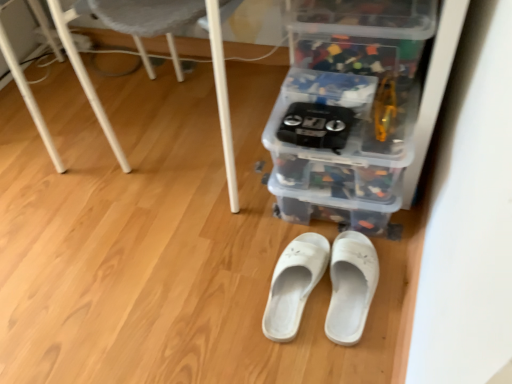
At what (x,y) coordinates should I click in order to perform the action: click on white fabric slippers at center, the 1th footwear from the left. Please return your answer as a coordinate pair (x, y). The height and width of the screenshot is (384, 512). Looking at the image, I should click on (351, 286).

What is the approximate height of white fabric slipper at center, the 2th footwear positioned from the left?

7.73 centimeters.

What do you see at coordinates (177, 55) in the screenshot? This screenshot has height=384, width=512. I see `white plastic chair at lower center` at bounding box center [177, 55].

The height and width of the screenshot is (384, 512). Find the location of `clear plastic storage box at center, which ranks as the third storage box in top-to-bottom order`. clear plastic storage box at center, which ranks as the third storage box in top-to-bottom order is located at coordinates (342, 196).

Does white fabric slippers at center, the 1th footwear from the left, have a smaller size compared to transparent plastic storage box at center, the 2th storage box positioned from the bottom?

Yes.

Between point (309, 237) and point (436, 1), which one is positioned behind?

Positioned behind is point (309, 237).

Considering the sizes of objects white fabric slippers at center, placed as the second footwear when sorted from right to left, and transparent plastic storage box at center, which is the second storage box in top-to-bottom order, in the image provided, who is taller, white fabric slippers at center, placed as the second footwear when sorted from right to left, or transparent plastic storage box at center, which is the second storage box in top-to-bottom order,?

With more height is transparent plastic storage box at center, which is the second storage box in top-to-bottom order.

Looking at their sizes, would you say white fabric slippers at center, placed as the second footwear when sorted from right to left, is wider or thinner than transparent plastic storage box at center, the 2th storage box positioned from the bottom?

Clearly, white fabric slippers at center, placed as the second footwear when sorted from right to left, has less width compared to transparent plastic storage box at center, the 2th storage box positioned from the bottom.

You are a GUI agent. You are given a task and a screenshot of the screen. Output one action in this format:
    pyautogui.click(x=<x>, y=<y>)
    Task: Click on the storage box located on the right of transparent plastic storage box at center, which is the second storage box in top-to-bottom order
    This screenshot has width=512, height=384.
    Given the screenshot: What is the action you would take?
    pyautogui.click(x=356, y=55)

Which of these two, transparent plastic storage box at center, the 2th storage box positioned from the bottom, or translucent plastic storage box at center, the 1th storage box in the top-to-bottom sequence, stands shorter?

With less height is translucent plastic storage box at center, the 1th storage box in the top-to-bottom sequence.

Is transparent plastic storage box at center, the 2th storage box positioned from the bottom, next to translucent plastic storage box at center, the 3th storage box in the bottom-to-top sequence?

No, transparent plastic storage box at center, the 2th storage box positioned from the bottom, is not with translucent plastic storage box at center, the 3th storage box in the bottom-to-top sequence.

Locate an element on the screen. furniture on the left of the translucent plastic storage box at center, the 3th storage box in the bottom-to-top sequence is located at coordinates 177,55.

How distant is translucent plastic storage box at center, the 3th storage box in the bottom-to-top sequence, from white plastic chair at lower center?

translucent plastic storage box at center, the 3th storage box in the bottom-to-top sequence, and white plastic chair at lower center are 14.52 inches apart from each other.

Which is in front, point (342, 37) or point (140, 3)?

The point (342, 37) is more forward.

Can you confirm if translucent plastic storage box at center, the 1th storage box in the top-to-bottom sequence, is shorter than white plastic chair at lower center?

Correct, translucent plastic storage box at center, the 1th storage box in the top-to-bottom sequence, is not as tall as white plastic chair at lower center.

Considering the sizes of objects white fabric slipper at center, the 2th footwear positioned from the left, and transparent plastic storage box at center, which is the second storage box in top-to-bottom order, in the image provided, who is thinner, white fabric slipper at center, the 2th footwear positioned from the left, or transparent plastic storage box at center, which is the second storage box in top-to-bottom order,?

white fabric slipper at center, the 2th footwear positioned from the left, is thinner.

Is white fabric slipper at center, the 2th footwear positioned from the left, not within transparent plastic storage box at center, the 2th storage box positioned from the bottom?

Indeed, white fabric slipper at center, the 2th footwear positioned from the left, is completely outside transparent plastic storage box at center, the 2th storage box positioned from the bottom.

Consider the image. Could you tell me if white fabric slipper at center, which is the first footwear from right to left, is turned towards transparent plastic storage box at center, which is the second storage box in top-to-bottom order?

No.

Between white fabric slipper at center, the 2th footwear positioned from the left, and transparent plastic storage box at center, which is the second storage box in top-to-bottom order, which one is positioned in front?

transparent plastic storage box at center, which is the second storage box in top-to-bottom order, is closer to the camera.

From a real-world perspective, which object rests below the other?

From a 3D spatial view, white fabric slippers at center, placed as the second footwear when sorted from right to left, is below.

Is white fabric slipper at center, the 2th footwear positioned from the left, taller or shorter than white fabric slippers at center, the 1th footwear from the left?

Clearly, white fabric slipper at center, the 2th footwear positioned from the left, is shorter compared to white fabric slippers at center, the 1th footwear from the left.

Is white fabric slippers at center, placed as the second footwear when sorted from right to left, surrounded by white fabric slipper at center, the 2th footwear positioned from the left?

No.

Considering the sizes of objects white fabric slipper at center, which is the first footwear from right to left, and white fabric slippers at center, placed as the second footwear when sorted from right to left, in the image provided, who is thinner, white fabric slipper at center, which is the first footwear from right to left, or white fabric slippers at center, placed as the second footwear when sorted from right to left,?

white fabric slippers at center, placed as the second footwear when sorted from right to left, is thinner.

Considering the sizes of objects white plastic chair at lower center and transparent plastic storage box at center, the 2th storage box positioned from the bottom, in the image provided, who is smaller, white plastic chair at lower center or transparent plastic storage box at center, the 2th storage box positioned from the bottom,?

transparent plastic storage box at center, the 2th storage box positioned from the bottom.

Considering the positions of point (236, 185) and point (302, 133), is point (236, 185) closer or farther from the camera than point (302, 133)?

Point (236, 185).

From the image's perspective, is white plastic chair at lower center located above or below transparent plastic storage box at center, the 2th storage box positioned from the bottom?

Clearly, from the image's perspective, white plastic chair at lower center is above transparent plastic storage box at center, the 2th storage box positioned from the bottom.

From a real-world perspective, who is located higher, white plastic chair at lower center or transparent plastic storage box at center, which is the second storage box in top-to-bottom order?

white plastic chair at lower center.

How many degrees apart are the facing directions of white fabric slippers at center, placed as the second footwear when sorted from right to left, and white fabric slipper at center, the 2th footwear positioned from the left?

The angular difference between white fabric slippers at center, placed as the second footwear when sorted from right to left, and white fabric slipper at center, the 2th footwear positioned from the left, is 0 degrees.

Considering the positions of objects white fabric slippers at center, the 1th footwear from the left, and white fabric slipper at center, which is the first footwear from right to left, in the image provided, who is in front, white fabric slippers at center, the 1th footwear from the left, or white fabric slipper at center, which is the first footwear from right to left,?

A: white fabric slipper at center, which is the first footwear from right to left, is closer to the camera.

Is white fabric slippers at center, placed as the second footwear when sorted from right to left, spatially inside white fabric slipper at center, the 2th footwear positioned from the left, or outside of it?

white fabric slippers at center, placed as the second footwear when sorted from right to left, is spatially situated outside white fabric slipper at center, the 2th footwear positioned from the left.

From the transparent plastic storage box at center, the 2th storage box positioned from the bottom, count 2nd footwears backward and point to it. Please provide its 2D coordinates.

[(351, 286)]

At what (x,y) coordinates should I click in order to perform the action: click on storage box on the right of transparent plastic storage box at center, the 2th storage box positioned from the bottom. Please return your answer as a coordinate pair (x, y). This screenshot has height=384, width=512. Looking at the image, I should click on (356, 55).

When comparing their distances from white fabric slippers at center, placed as the second footwear when sorted from right to left, does translucent plastic storage box at center, the 1th storage box in the top-to-bottom sequence, or clear plastic storage box at center, which ranks as the third storage box in top-to-bottom order, seem closer?

The object closer to white fabric slippers at center, placed as the second footwear when sorted from right to left, is clear plastic storage box at center, which ranks as the third storage box in top-to-bottom order.

In the scene shown: Estimate the real-world distances between objects in this image. Which object is closer to white fabric slipper at center, which is the first footwear from right to left, translucent plastic storage box at center, the 3th storage box in the bottom-to-top sequence, or white plastic chair at lower center?

The object closer to white fabric slipper at center, which is the first footwear from right to left, is translucent plastic storage box at center, the 3th storage box in the bottom-to-top sequence.

Which object lies further to the anchor point white plastic chair at lower center, clear plastic storage box at center, which is the first storage box in bottom-to-top order, or transparent plastic storage box at center, the 2th storage box positioned from the bottom?

clear plastic storage box at center, which is the first storage box in bottom-to-top order.

Estimate the real-world distances between objects in this image. Which object is closer to white fabric slippers at center, placed as the second footwear when sorted from right to left, clear plastic storage box at center, which ranks as the third storage box in top-to-bottom order, or white plastic chair at lower center?

clear plastic storage box at center, which ranks as the third storage box in top-to-bottom order.

Estimate the real-world distances between objects in this image. Which object is further from transparent plastic storage box at center, the 2th storage box positioned from the bottom, white plastic chair at lower center or translucent plastic storage box at center, the 3th storage box in the bottom-to-top sequence?

Among the two, white plastic chair at lower center is located further to transparent plastic storage box at center, the 2th storage box positioned from the bottom.

When comparing their distances from clear plastic storage box at center, which ranks as the third storage box in top-to-bottom order, does white fabric slippers at center, the 1th footwear from the left, or white fabric slipper at center, which is the first footwear from right to left, seem further?

white fabric slippers at center, the 1th footwear from the left, lies further to clear plastic storage box at center, which ranks as the third storage box in top-to-bottom order, than the other object.

Looking at the image, which one is located further to translucent plastic storage box at center, the 3th storage box in the bottom-to-top sequence, white plastic chair at lower center or white fabric slippers at center, placed as the second footwear when sorted from right to left?

white fabric slippers at center, placed as the second footwear when sorted from right to left.

Considering their positions, is white plastic chair at lower center positioned further to clear plastic storage box at center, which is the first storage box in bottom-to-top order, than white fabric slipper at center, which is the first footwear from right to left?

white plastic chair at lower center lies further to clear plastic storage box at center, which is the first storage box in bottom-to-top order, than the other object.

The image size is (512, 384). Identify the location of storage box between white plastic chair at lower center and transparent plastic storage box at center, the 2th storage box positioned from the bottom, from left to right. (342, 196).

This screenshot has height=384, width=512. Identify the location of footwear between white plastic chair at lower center and white fabric slipper at center, which is the first footwear from right to left, in the up-down direction. (351, 286).

Where is `furniture between translucent plastic storage box at center, the 3th storage box in the bottom-to-top sequence, and white fabric slippers at center, the 1th footwear from the left, in the up-down direction`? The height and width of the screenshot is (384, 512). furniture between translucent plastic storage box at center, the 3th storage box in the bottom-to-top sequence, and white fabric slippers at center, the 1th footwear from the left, in the up-down direction is located at coordinates (177, 55).

Locate an element on the screen. footwear between clear plastic storage box at center, which is the first storage box in bottom-to-top order, and white fabric slipper at center, the 2th footwear positioned from the left, in the up-down direction is located at coordinates (351, 286).